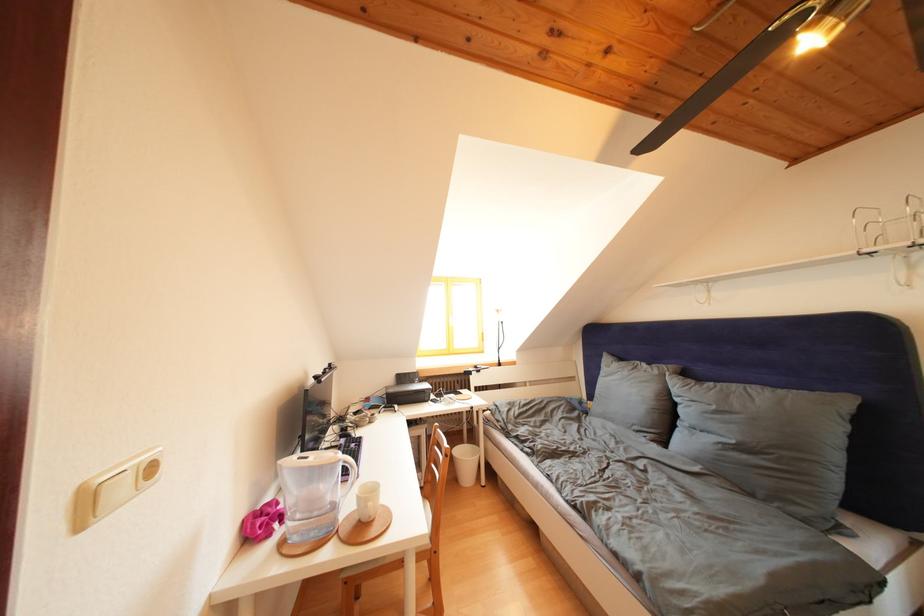
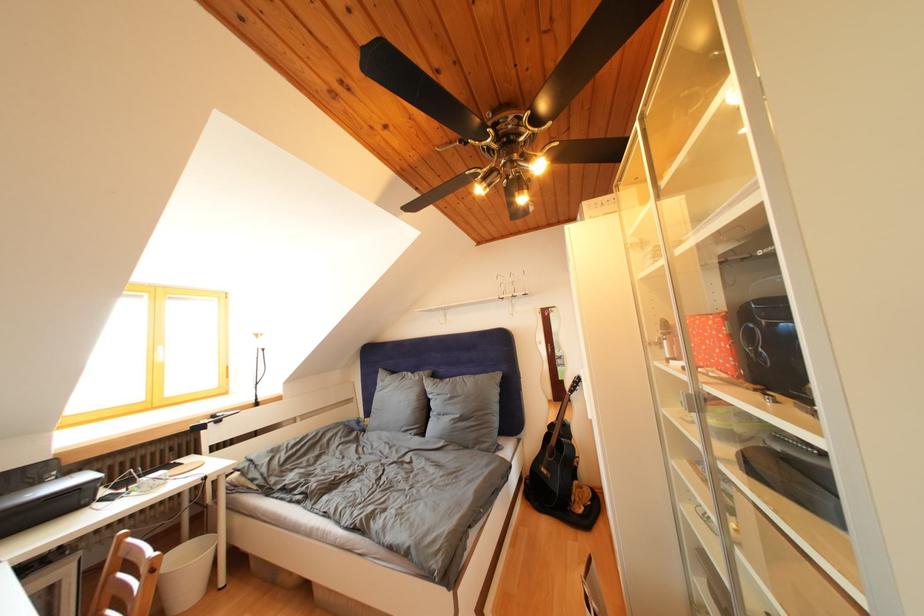
In the second image, find the point that corresponds to point (441, 450) in the first image.

(119, 578)